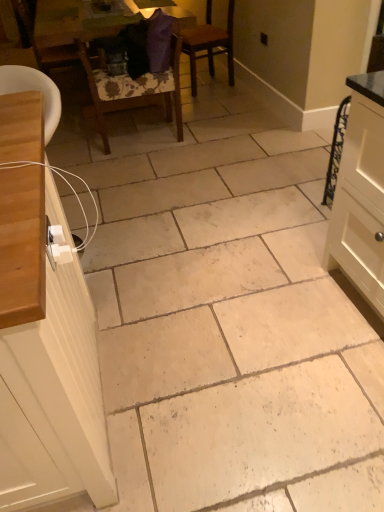
Locate an element on the screen. The width and height of the screenshot is (384, 512). vacant space to the right of wooden chair at center, the 2th chair in the left-to-right sequence is located at coordinates (210, 135).